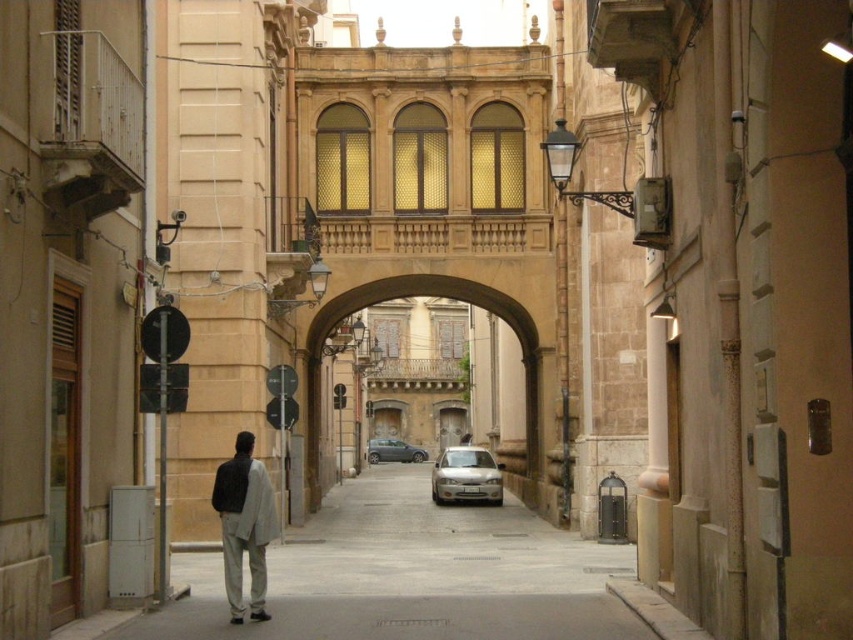
Question: Estimate the real-world distances between objects in this image. Which object is farther from the matte stone archway at center?

Choices:
 (A) silver metallic car at center
 (B) metallic gray sedan at center

Answer: (B)

Question: Considering the relative positions of gray concrete pavement at center and light beige pants at center in the image provided, where is gray concrete pavement at center located with respect to light beige pants at center?

Choices:
 (A) left
 (B) right

Answer: (B)

Question: Is gray concrete pavement at center below silver metallic car at center?

Choices:
 (A) yes
 (B) no

Answer: (B)

Question: Does matte stone archway at center come in front of silver metallic car at center?

Choices:
 (A) no
 (B) yes

Answer: (B)

Question: Which object is closer to the camera taking this photo?

Choices:
 (A) metallic gray sedan at center
 (B) silver metallic car at center
 (C) matte stone archway at center
 (D) light beige pants at center

Answer: (D)

Question: Among these points, which one is farthest from the camera?

Choices:
 (A) (244, 545)
 (B) (352, 564)
 (C) (450, 483)

Answer: (C)